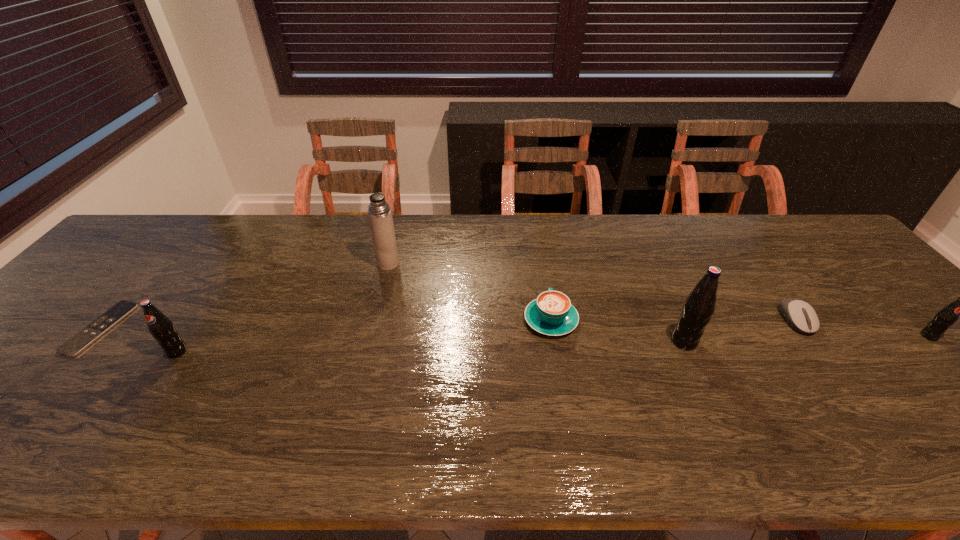
Identify the location of the farthest object. The width and height of the screenshot is (960, 540). 379,213.

The image size is (960, 540). I want to click on the fifth object from right to left, so click(x=379, y=213).

The image size is (960, 540). In order to click on computer equipment in this screenshot , I will do `click(800, 315)`.

The image size is (960, 540). Identify the location of the second object from right to left. (800, 315).

Where is `free space located on the front label of the leftmost pop`? free space located on the front label of the leftmost pop is located at coordinates (146, 400).

Locate an element on the screen. vacant space situated on the front label of the fifth object from left to right is located at coordinates (800, 341).

This screenshot has width=960, height=540. Find the location of `free space located on the front label of the fourth shortest object`. free space located on the front label of the fourth shortest object is located at coordinates (951, 358).

Where is `vacant position located on the right of the leftmost object`? vacant position located on the right of the leftmost object is located at coordinates (157, 328).

Where is `vacant space located 0.300m with the handle on the right side of the fourth object from right to left`? The width and height of the screenshot is (960, 540). vacant space located 0.300m with the handle on the right side of the fourth object from right to left is located at coordinates pos(537,236).

Where is `free location located with the handle on the right side of the fourth object from right to left`? free location located with the handle on the right side of the fourth object from right to left is located at coordinates (545, 289).